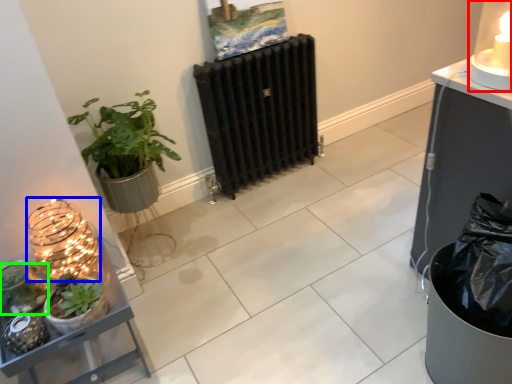
Question: Which is farther away from candle holder (highlighted by a red box)? candle holder (highlighted by a blue box) or vegetation (highlighted by a green box)?

Choices:
 (A) candle holder
 (B) vegetation

Answer: (B)